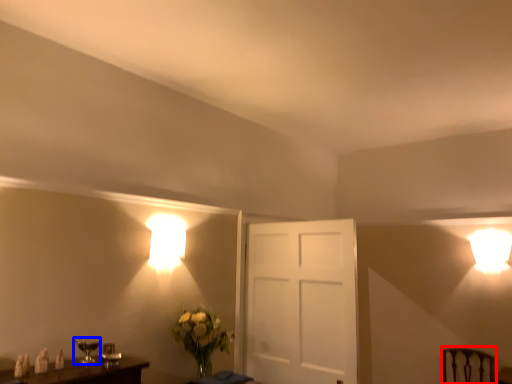
Question: Which object is further to the camera taking this photo, swivel chair (highlighted by a red box) or table lamp (highlighted by a blue box)?

Choices:
 (A) swivel chair
 (B) table lamp

Answer: (A)